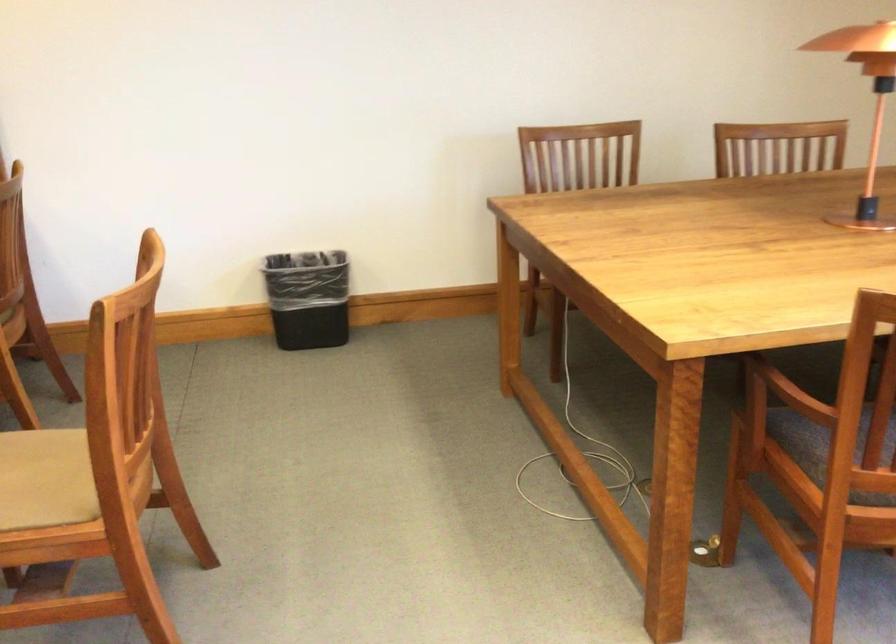
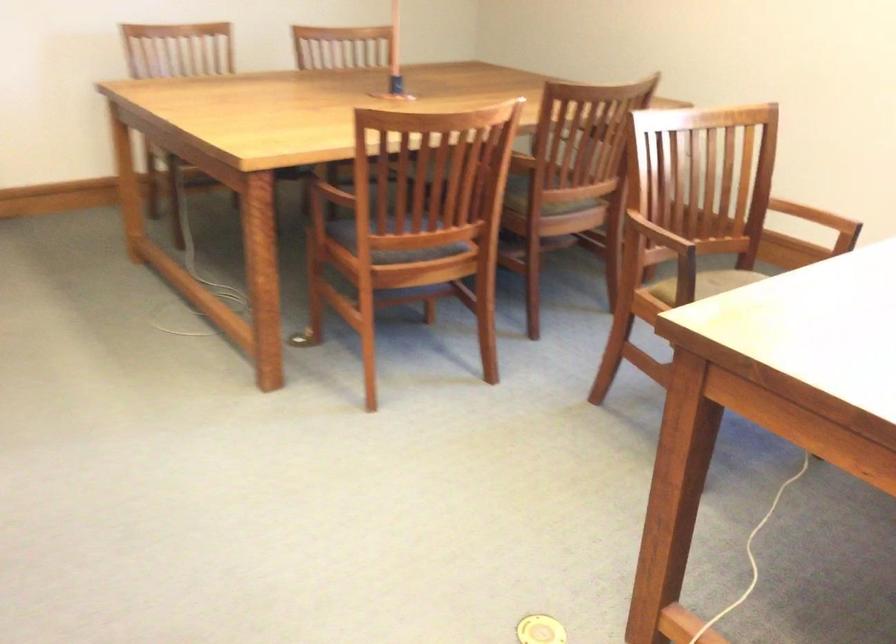
Question: Based on the continuous images, in which direction is the camera rotating? Reply with the corresponding letter.

Choices:
 (A) Left
 (B) Right
 (C) Up
 (D) Down

Answer: (B)